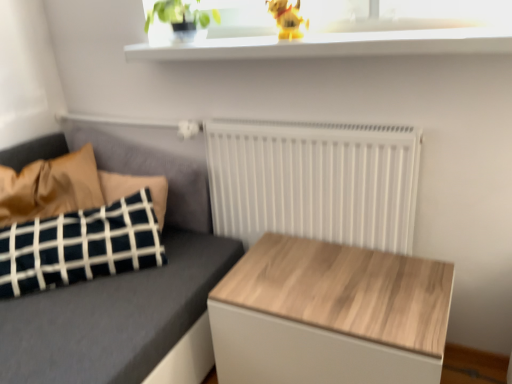
At what (x,y) coordinates should I click in order to perform the action: click on vacant point to the right of yellow plastic dog at upper center. Please return your answer as a coordinate pair (x, y). Looking at the image, I should click on (331, 36).